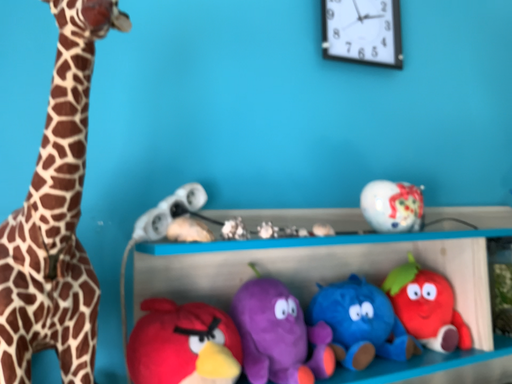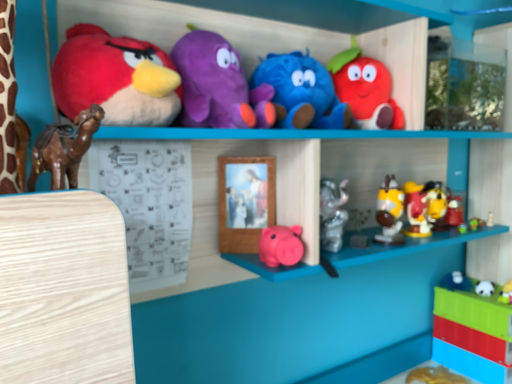
Question: Which way did the camera rotate in the video?

Choices:
 (A) rotated left
 (B) rotated right

Answer: (B)